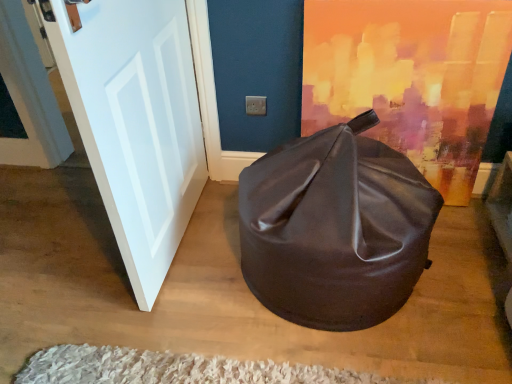
The image size is (512, 384). I want to click on empty space that is in between shiny brown bean bag at center and white shaggy rug at lower center, so click(x=257, y=336).